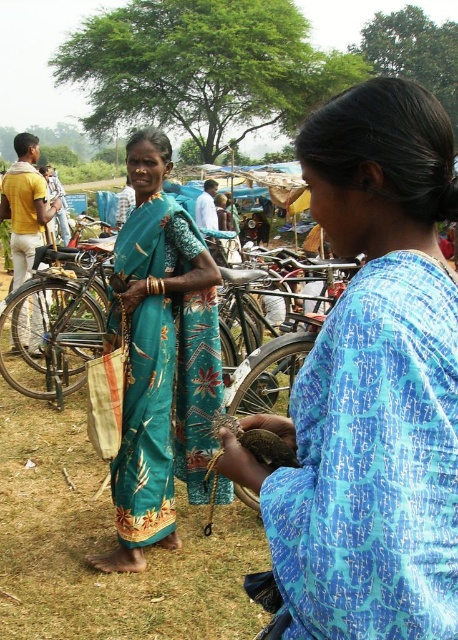
Who is higher up, blue printed dress at center or yellow cotton shirt at left?

Positioned higher is yellow cotton shirt at left.

Does blue printed dress at center appear on the right side of yellow cotton shirt at left?

Correct, you'll find blue printed dress at center to the right of yellow cotton shirt at left.

This screenshot has height=640, width=458. Identify the location of blue printed dress at center. (371, 385).

Is blue printed dress at center taller than metallic silver bicycle at left?

No, blue printed dress at center is not taller than metallic silver bicycle at left.

Which is below, blue printed dress at center or metallic silver bicycle at left?

metallic silver bicycle at left is lower down.

The image size is (458, 640). Describe the element at coordinates (371, 385) in the screenshot. I see `blue printed dress at center` at that location.

Where is `blue printed dress at center`? The image size is (458, 640). blue printed dress at center is located at coordinates (371, 385).

Is teal printed sari at center behind metallic silver bicycle at left?

No, it is not.

Can you confirm if teal printed sari at center is bigger than metallic silver bicycle at left?

No.

Which is behind, point (219, 403) or point (71, 365)?

Positioned behind is point (71, 365).

Identify the location of teal printed sari at center. The image size is (458, 640). (161, 358).